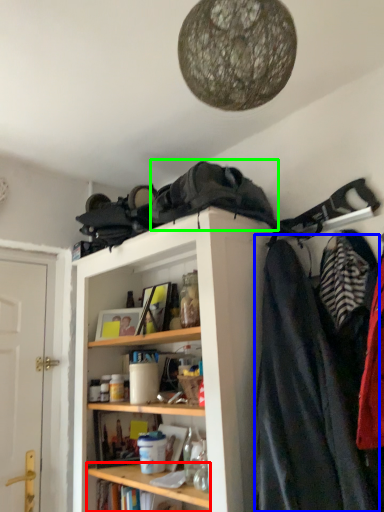
Question: Based on their relative distances, which object is nearer to cabinet (highlighted by a red box)? Choose from cloak (highlighted by a blue box) and cloak (highlighted by a green box).

Choices:
 (A) cloak
 (B) cloak

Answer: (A)